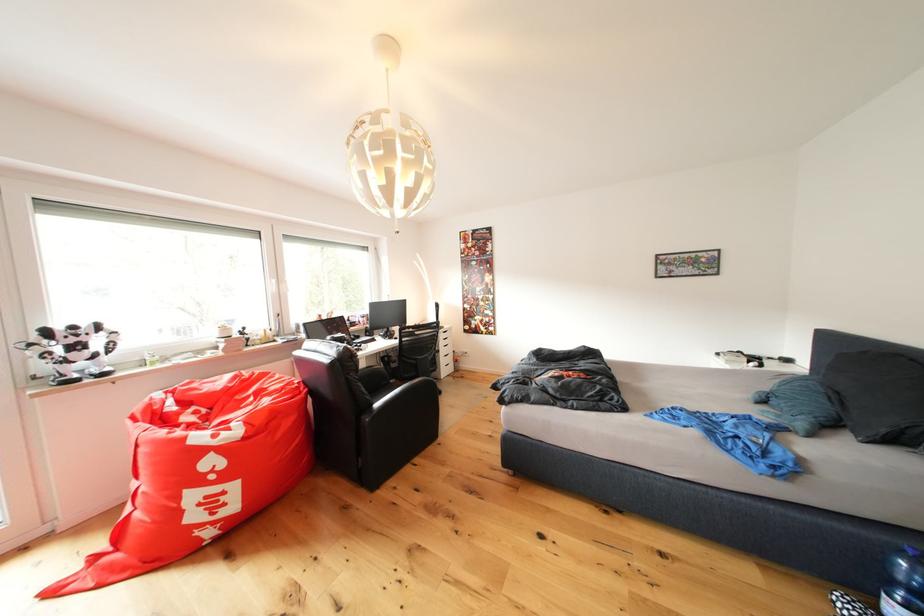
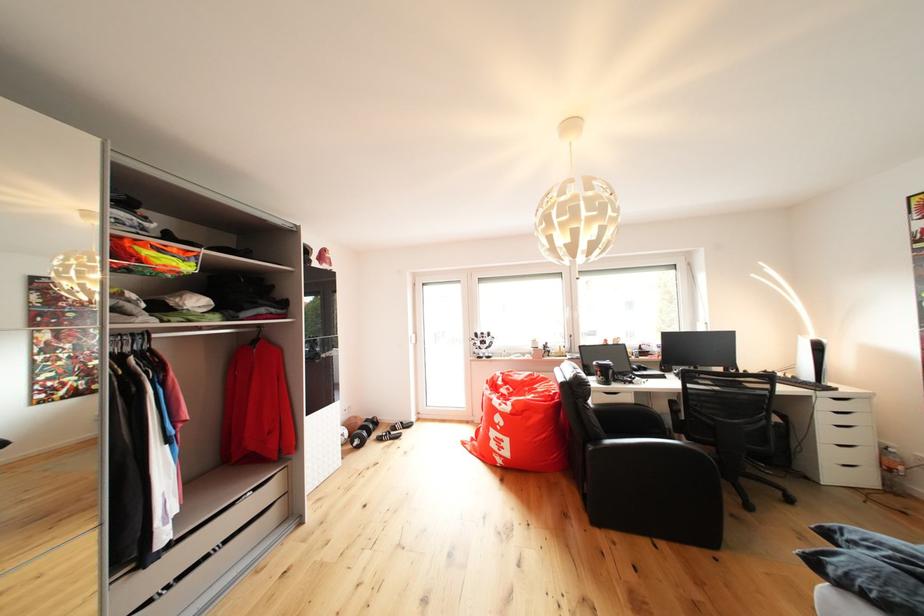
In the second image, find the point that corresponds to (x=455, y=331) in the first image.

(855, 395)